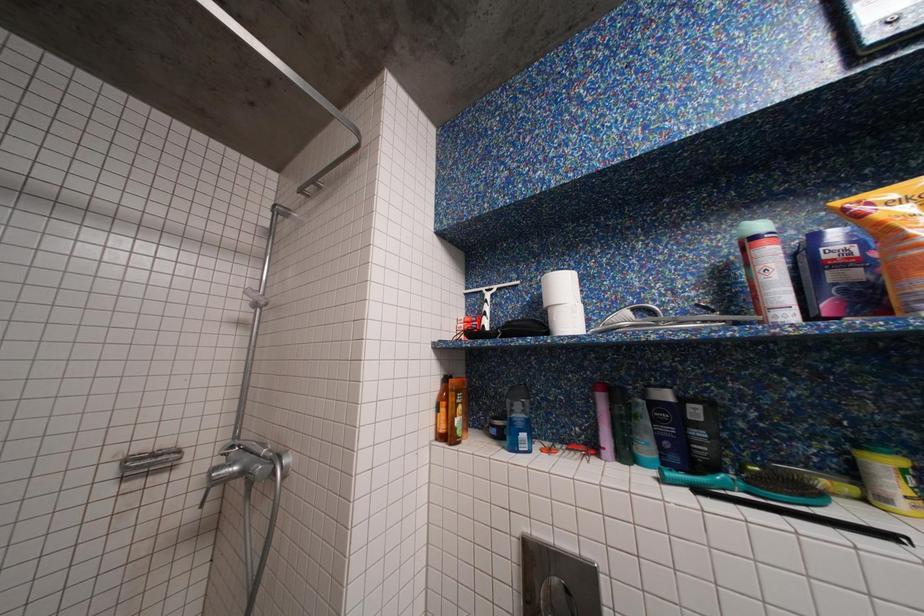
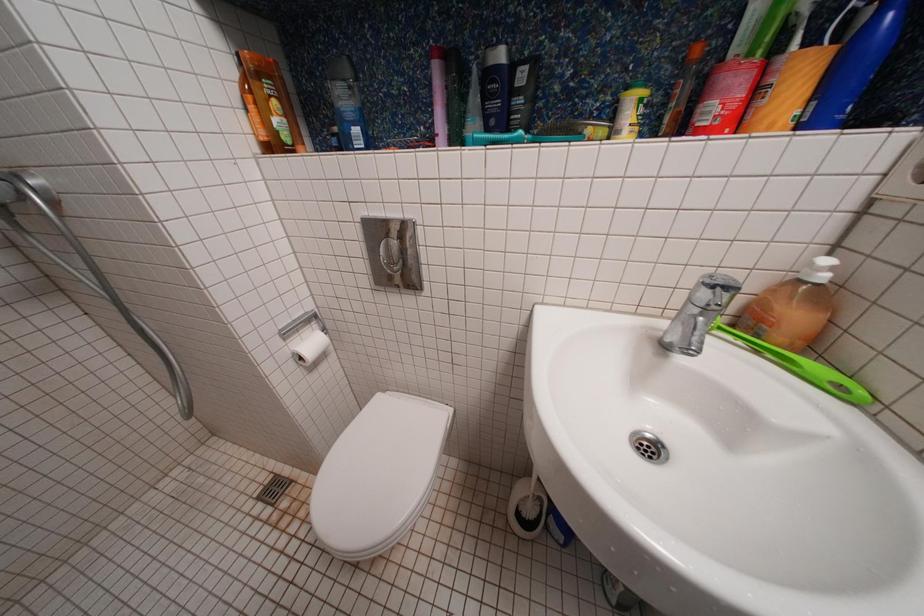
The images are taken continuously from a first-person perspective. In which direction is your viewpoint rotating?

The rotation direction of the camera is right-down.